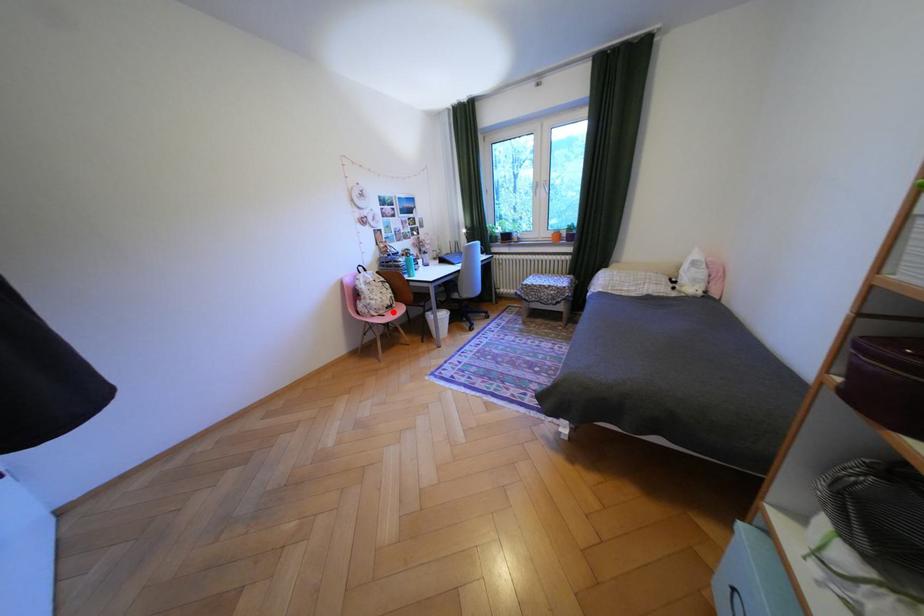
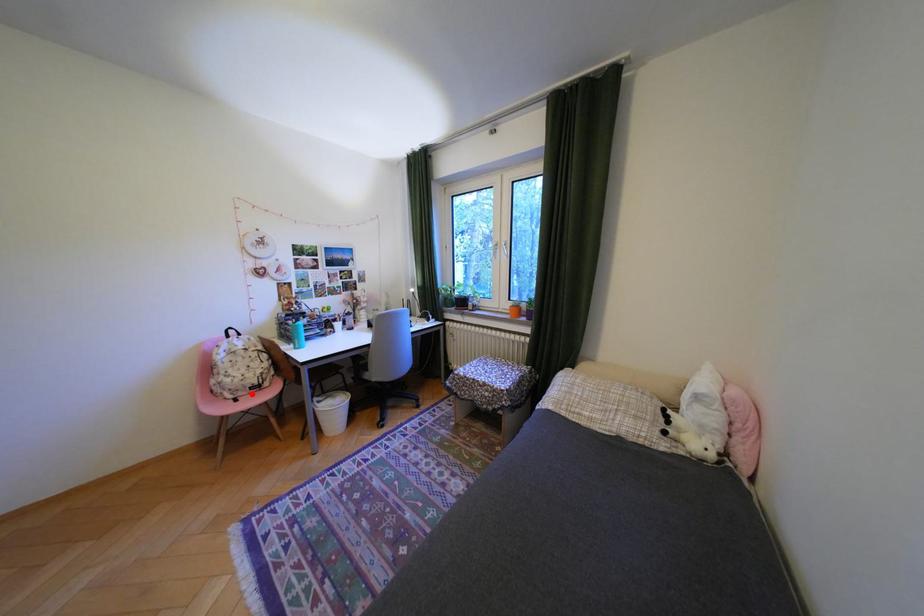
I am providing you with two images of the same scene from different viewpoints. A red point is marked on the first image and another point is marked on the second image. Are the points marked in image1 and image2 representing the same 3D position?

Yes